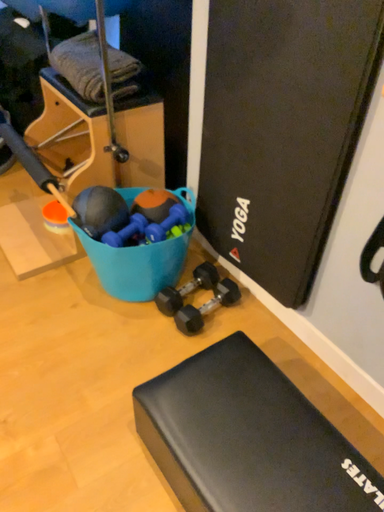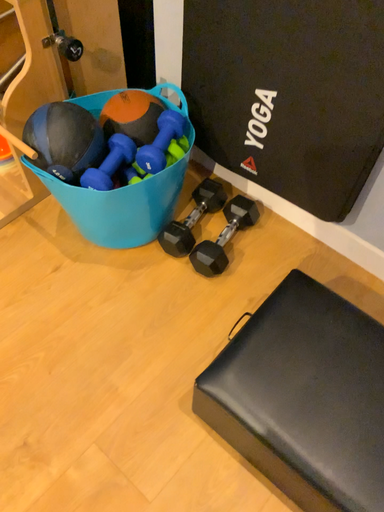
Question: Which way did the camera rotate in the video?

Choices:
 (A) rotated right
 (B) rotated left

Answer: (A)